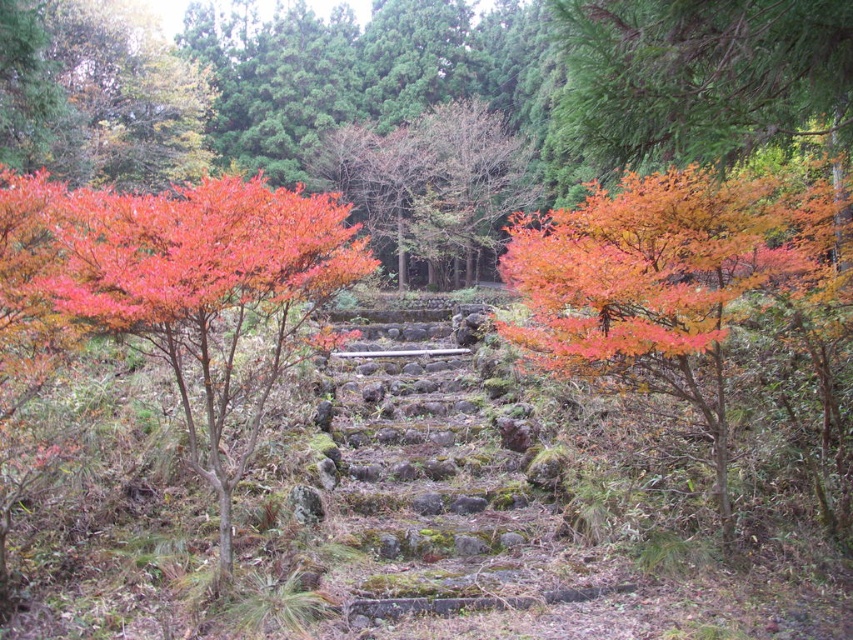
Question: Which of the following is the farthest from the observer?

Choices:
 (A) shiny orange maple at center
 (B) shiny red maple tree at left

Answer: (A)

Question: Is shiny orange maple at center smaller than shiny red maple tree at left?

Choices:
 (A) yes
 (B) no

Answer: (A)

Question: Does shiny orange maple at center have a smaller size compared to shiny red maple tree at left?

Choices:
 (A) no
 (B) yes

Answer: (B)

Question: Which object is closer to the camera taking this photo?

Choices:
 (A) shiny orange maple at center
 (B) shiny red maple tree at left

Answer: (B)

Question: Does shiny orange maple at center have a greater width compared to shiny red maple tree at left?

Choices:
 (A) yes
 (B) no

Answer: (B)

Question: Which point is closer to the camera?

Choices:
 (A) shiny orange maple at center
 (B) shiny red maple tree at left

Answer: (B)